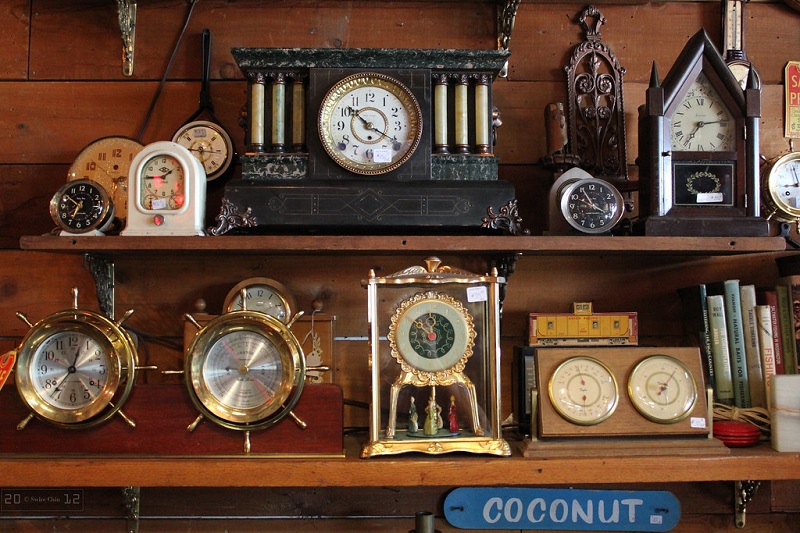
Where is `books on bottom shelf`? books on bottom shelf is located at coordinates (714, 317), (705, 323), (734, 327), (750, 345), (764, 344), (777, 336), (792, 329).